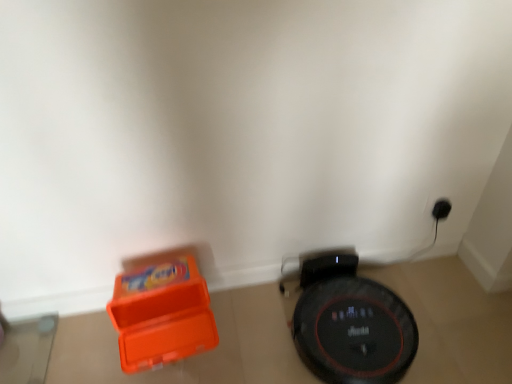
Measure the distance between black glossy robot vacuum cleaner at lower right and camera.

3.62 feet.

The height and width of the screenshot is (384, 512). Describe the element at coordinates (354, 331) in the screenshot. I see `black glossy robot vacuum cleaner at lower right` at that location.

I want to click on black glossy robot vacuum cleaner at lower right, so click(x=354, y=331).

You are a GUI agent. You are given a task and a screenshot of the screen. Output one action in this format:
    pyautogui.click(x=<x>, y=<y>)
    Task: Click on the orange plastic toy at lower left
    The width and height of the screenshot is (512, 384).
    Given the screenshot: What is the action you would take?
    pyautogui.click(x=161, y=312)

What do you see at coordinates (161, 312) in the screenshot? The width and height of the screenshot is (512, 384). I see `orange plastic toy at lower left` at bounding box center [161, 312].

This screenshot has height=384, width=512. I want to click on black glossy robot vacuum cleaner at lower right, so click(x=354, y=331).

Based on the photo, which object is positioned more to the right, orange plastic toy at lower left or black glossy robot vacuum cleaner at lower right?

black glossy robot vacuum cleaner at lower right is more to the right.

Between orange plastic toy at lower left and black glossy robot vacuum cleaner at lower right, which one is positioned behind?

black glossy robot vacuum cleaner at lower right.

Which point is more distant from viewer, [131,300] or [298,329]?

The point [298,329] is more distant.

From the image's perspective, who appears lower, orange plastic toy at lower left or black glossy robot vacuum cleaner at lower right?

black glossy robot vacuum cleaner at lower right is shown below in the image.

From a real-world perspective, between orange plastic toy at lower left and black glossy robot vacuum cleaner at lower right, who is vertically higher?

From a 3D spatial view, orange plastic toy at lower left is above.

Between orange plastic toy at lower left and black glossy robot vacuum cleaner at lower right, which one has larger width?

black glossy robot vacuum cleaner at lower right.

Between orange plastic toy at lower left and black glossy robot vacuum cleaner at lower right, which one has less height?

With less height is black glossy robot vacuum cleaner at lower right.

In terms of size, does orange plastic toy at lower left appear bigger or smaller than black glossy robot vacuum cleaner at lower right?

In the image, orange plastic toy at lower left appears to be smaller than black glossy robot vacuum cleaner at lower right.

Is orange plastic toy at lower left inside or outside of black glossy robot vacuum cleaner at lower right?

orange plastic toy at lower left is not enclosed by black glossy robot vacuum cleaner at lower right.

Would you say orange plastic toy at lower left is a long distance from black glossy robot vacuum cleaner at lower right?

No, orange plastic toy at lower left is not far from black glossy robot vacuum cleaner at lower right.

Is orange plastic toy at lower left facing towards black glossy robot vacuum cleaner at lower right?

No, orange plastic toy at lower left is not aimed at black glossy robot vacuum cleaner at lower right.

How many degrees apart are the facing directions of orange plastic toy at lower left and black glossy robot vacuum cleaner at lower right?

The angular difference between orange plastic toy at lower left and black glossy robot vacuum cleaner at lower right is 7.13 degrees.

The height and width of the screenshot is (384, 512). In order to click on toy on the left side of black glossy robot vacuum cleaner at lower right in this screenshot , I will do `click(161, 312)`.

Considering the positions of objects black glossy robot vacuum cleaner at lower right and orange plastic toy at lower left in the image provided, who is more to the right, black glossy robot vacuum cleaner at lower right or orange plastic toy at lower left?

Positioned to the right is black glossy robot vacuum cleaner at lower right.

Relative to orange plastic toy at lower left, is black glossy robot vacuum cleaner at lower right in front or behind?

Visually, black glossy robot vacuum cleaner at lower right is located behind orange plastic toy at lower left.

Which point is more forward, (385,361) or (203,326)?

The point (203,326) is closer.

From the image's perspective, is black glossy robot vacuum cleaner at lower right below orange plastic toy at lower left?

Yes.

From a real-world perspective, relative to orange plastic toy at lower left, is black glossy robot vacuum cleaner at lower right vertically above or below?

black glossy robot vacuum cleaner at lower right is below orange plastic toy at lower left.

In terms of width, does black glossy robot vacuum cleaner at lower right look wider or thinner when compared to orange plastic toy at lower left?

In the image, black glossy robot vacuum cleaner at lower right appears to be wider than orange plastic toy at lower left.

In terms of height, does black glossy robot vacuum cleaner at lower right look taller or shorter compared to orange plastic toy at lower left?

black glossy robot vacuum cleaner at lower right is shorter than orange plastic toy at lower left.

Based on their sizes in the image, would you say black glossy robot vacuum cleaner at lower right is bigger or smaller than orange plastic toy at lower left?

In the image, black glossy robot vacuum cleaner at lower right appears to be larger than orange plastic toy at lower left.

Choose the correct answer: Is black glossy robot vacuum cleaner at lower right inside orange plastic toy at lower left or outside it?

black glossy robot vacuum cleaner at lower right lies outside orange plastic toy at lower left.

Is black glossy robot vacuum cleaner at lower right placed right next to orange plastic toy at lower left?

No.

Does black glossy robot vacuum cleaner at lower right turn towards orange plastic toy at lower left?

No, black glossy robot vacuum cleaner at lower right is not oriented towards orange plastic toy at lower left.

Can you tell me how much black glossy robot vacuum cleaner at lower right and orange plastic toy at lower left differ in facing direction?

The facing directions of black glossy robot vacuum cleaner at lower right and orange plastic toy at lower left are 7.13 degrees apart.

Could you measure the distance between black glossy robot vacuum cleaner at lower right and orange plastic toy at lower left?

The distance of black glossy robot vacuum cleaner at lower right from orange plastic toy at lower left is 39.37 centimeters.

Find the location of `wheel located below the orange plastic toy at lower left (from the image's perspective)`. wheel located below the orange plastic toy at lower left (from the image's perspective) is located at coordinates (354, 331).

Where is `wheel behind the orange plastic toy at lower left`? wheel behind the orange plastic toy at lower left is located at coordinates (354, 331).

Where is `toy lying above the black glossy robot vacuum cleaner at lower right (from the image's perspective)`? The height and width of the screenshot is (384, 512). toy lying above the black glossy robot vacuum cleaner at lower right (from the image's perspective) is located at coordinates (161, 312).